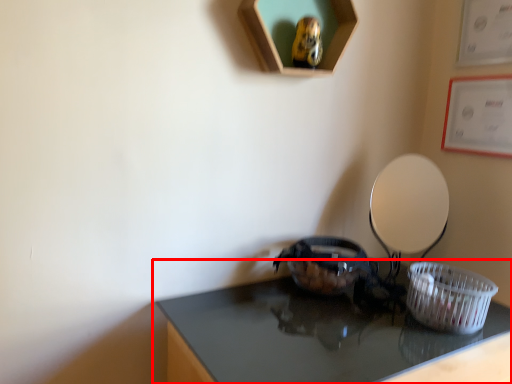
Question: From the image's perspective, what is the correct spatial relationship of table (annotated by the red box) in relation to basket?

Choices:
 (A) below
 (B) above

Answer: (A)